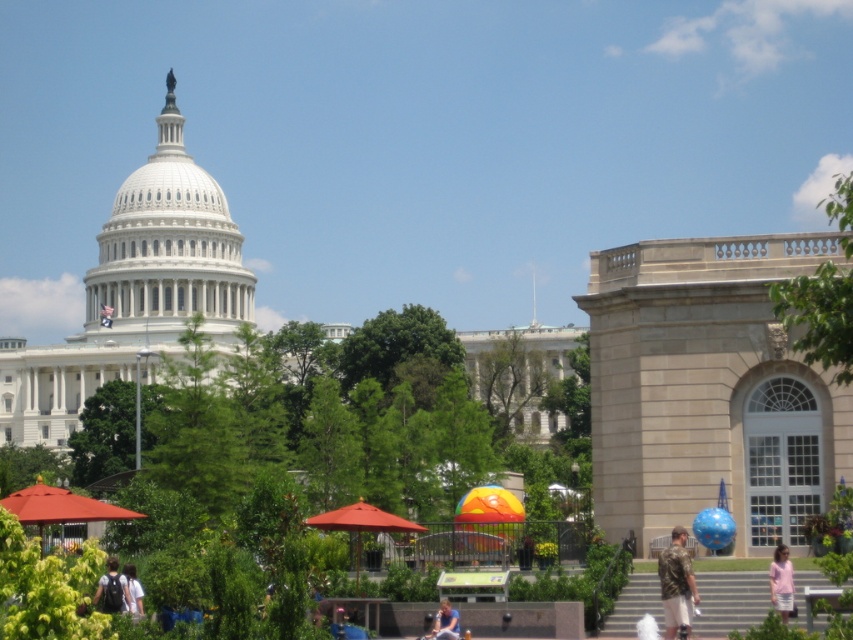
Can you confirm if dark gray backpack at lower left is thinner than light brown hair at lower center?

In fact, dark gray backpack at lower left might be wider than light brown hair at lower center.

Measure the distance between dark gray backpack at lower left and camera.

dark gray backpack at lower left and camera are 74.35 meters apart from each other.

Where is `dark gray backpack at lower left`? The width and height of the screenshot is (853, 640). dark gray backpack at lower left is located at coordinates (112, 589).

Is camo-patterned shirt at center-right to the left of matte orange umbrella at center from the viewer's perspective?

In fact, camo-patterned shirt at center-right is to the right of matte orange umbrella at center.

Between camo-patterned shirt at center-right and matte orange umbrella at center, which one has more height?

With more height is matte orange umbrella at center.

Is point (689, 576) behind point (340, 524)?

No, it is not.

This screenshot has height=640, width=853. What are the coordinates of `camo-patterned shirt at center-right` in the screenshot? It's located at (676, 584).

What are the coordinates of `green leafy tree at center` in the screenshot? It's located at (103, 433).

Who is more distant from viewer, (105, 435) or (792, 598)?

The point (105, 435) is behind.

Where is `green leafy tree at center`? This screenshot has width=853, height=640. green leafy tree at center is located at coordinates (103, 433).

Locate an element on the screen. green leafy tree at center is located at coordinates (103, 433).